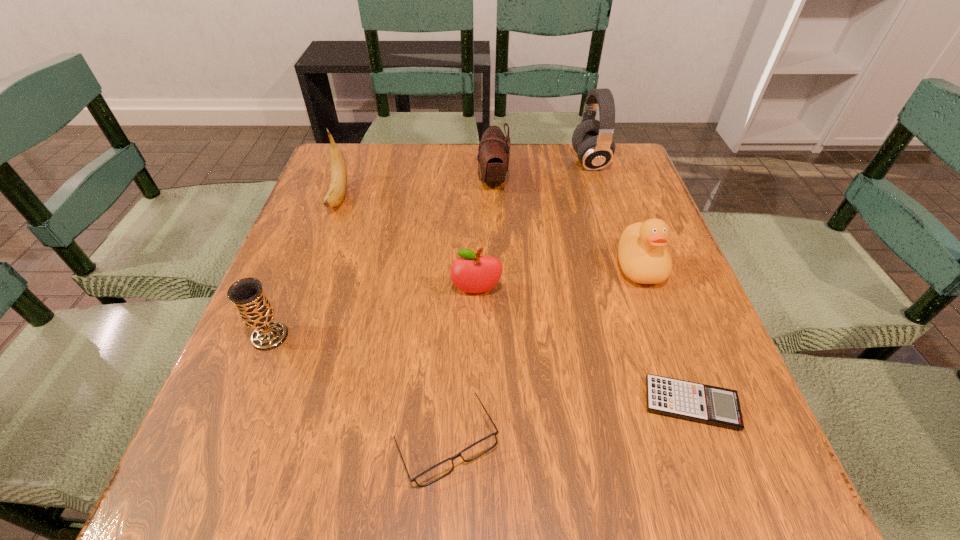
Where is `vacant space that satisfies the following two spatial constraints: 1. with the flap open on the pouch; 2. on the front side of the chalice`? The height and width of the screenshot is (540, 960). vacant space that satisfies the following two spatial constraints: 1. with the flap open on the pouch; 2. on the front side of the chalice is located at coordinates (498, 336).

This screenshot has height=540, width=960. In order to click on vacant space that satisfies the following two spatial constraints: 1. on the ear cups of the headset; 2. with the lenses facing outward on the spectacles in this screenshot , I will do `click(680, 443)`.